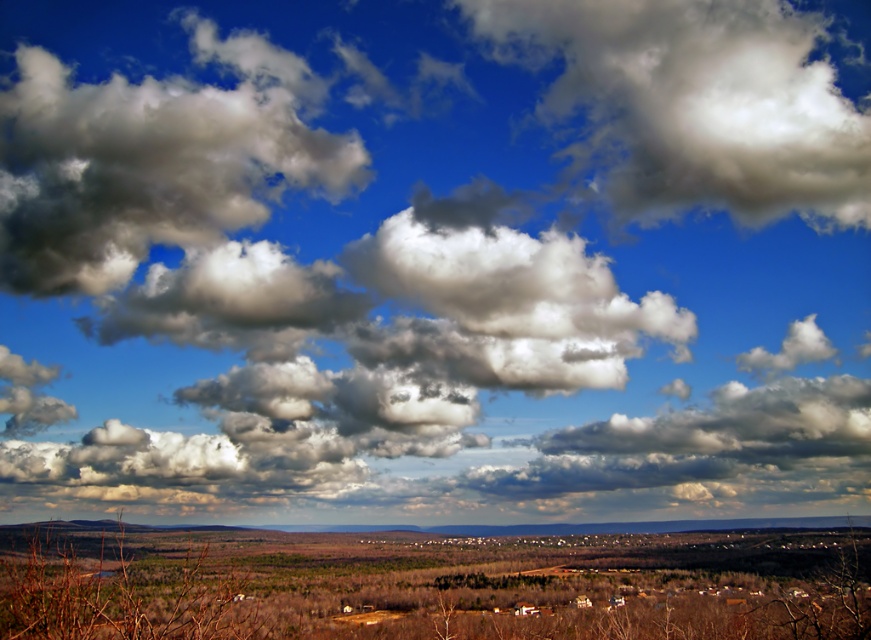
You are an artist painting this landscape. You want to emphasize the contrast between the white fluffy cloud at upper center and the brown grassland at lower center. Which object should you make darker to create this contrast?

To emphasize the contrast between the white fluffy cloud at upper center and the brown grassland at lower center, you should make the brown grassland at lower center darker since the cloud is thinner and lighter in comparison.